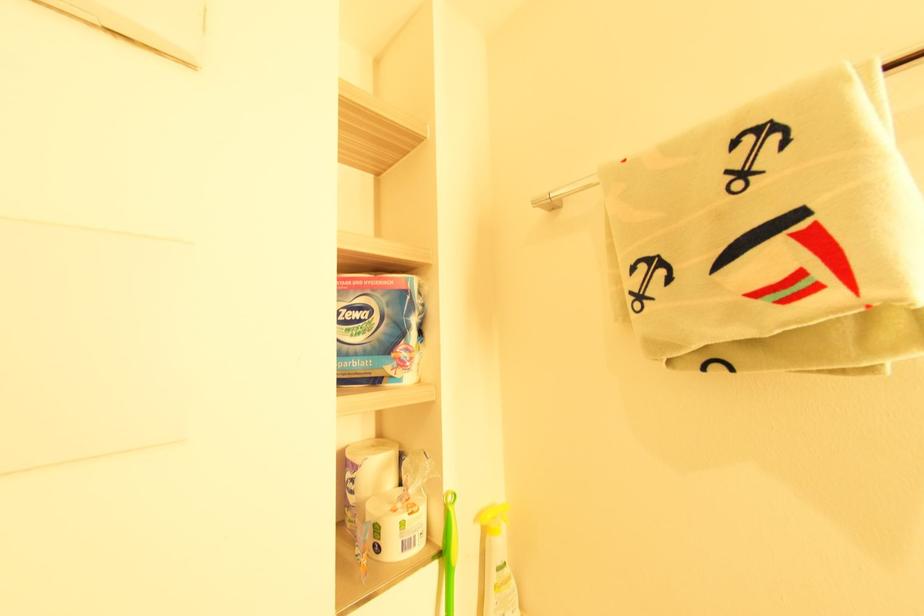
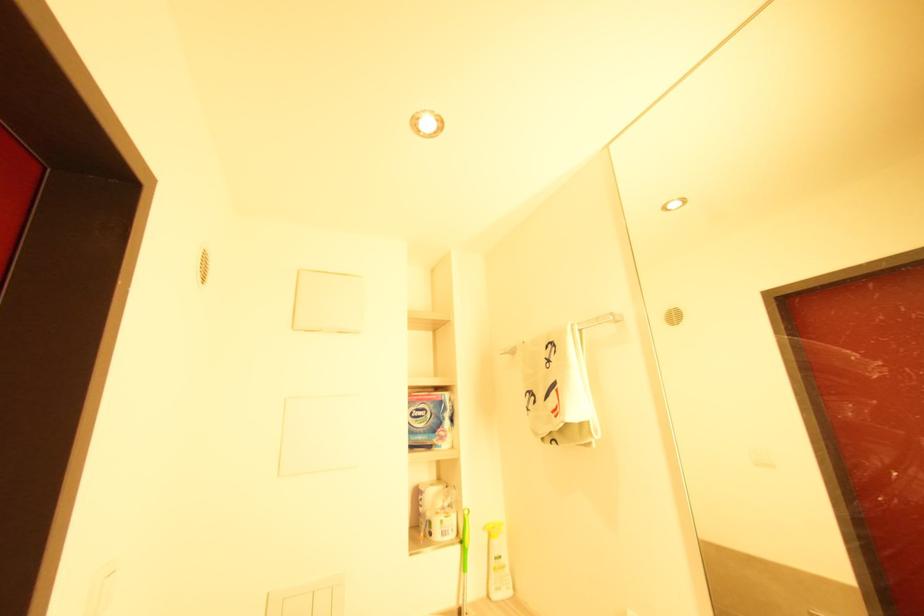
Question: The camera is either moving clockwise (left) or counter-clockwise (right) around the object. The first image is from the beginning of the video and the second image is from the end. Is the camera moving left or right when shooting the video?

Choices:
 (A) Left
 (B) Right

Answer: (B)